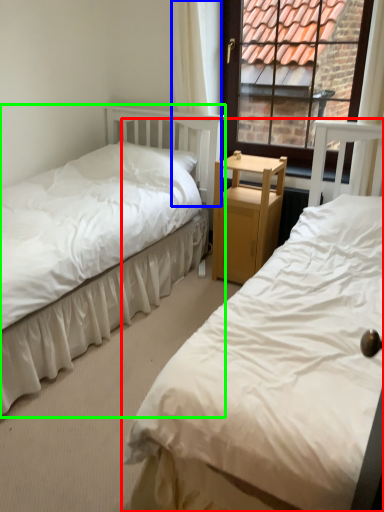
Question: Which is nearer to the bed (highlighted by a red box)? curtain (highlighted by a blue box) or bed (highlighted by a green box).

Choices:
 (A) curtain
 (B) bed

Answer: (B)